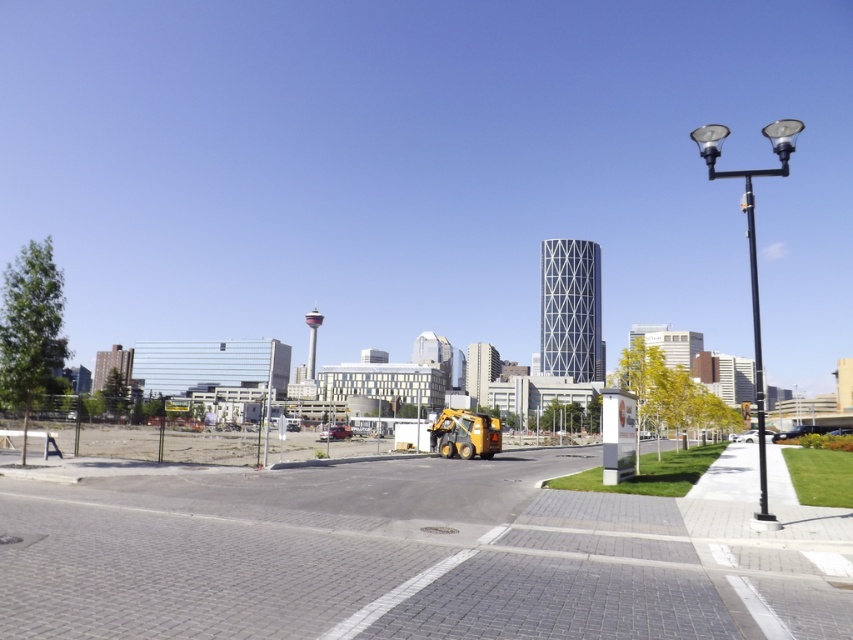
Which is more to the right, yellow compact tractor at center or black metal lamp post at right?

Positioned to the right is black metal lamp post at right.

Is yellow compact tractor at center thinner than black metal lamp post at right?

Yes, yellow compact tractor at center is thinner than black metal lamp post at right.

Identify the location of yellow compact tractor at center. (410, 556).